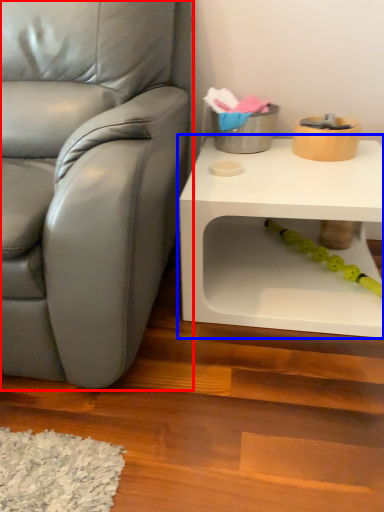
Question: Which object appears closest to the camera in this image, chair (highlighted by a red box) or table (highlighted by a blue box)?

Choices:
 (A) chair
 (B) table

Answer: (A)